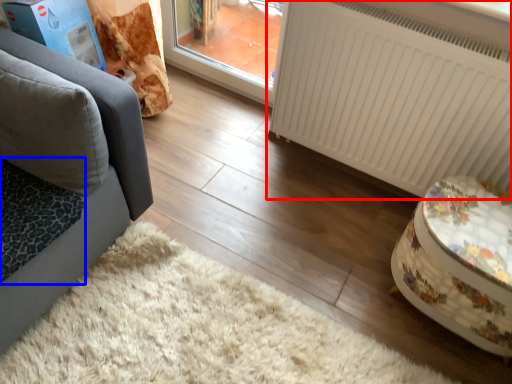
Question: Which object appears farthest to the camera in this image, radiator (highlighted by a red box) or cat bed (highlighted by a blue box)?

Choices:
 (A) radiator
 (B) cat bed

Answer: (A)